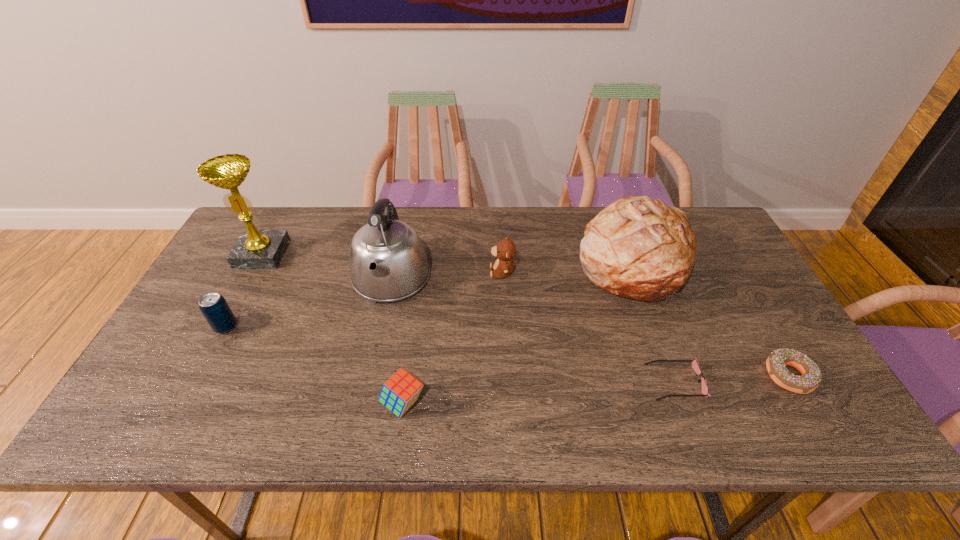
Locate an element on the screen. Image resolution: width=960 pixels, height=540 pixels. the tallest object is located at coordinates (255, 249).

This screenshot has width=960, height=540. Identify the location of kettle. (387, 260).

Where is `the third tallest object`? the third tallest object is located at coordinates (639, 248).

At what (x,y) coordinates should I click in order to perform the action: click on the fifth object from left to right. Please return your answer as a coordinate pair (x, y). The width and height of the screenshot is (960, 540). Looking at the image, I should click on (505, 250).

The height and width of the screenshot is (540, 960). I want to click on the fifth farthest object, so click(x=213, y=306).

Find the location of `cube`. cube is located at coordinates (401, 391).

You are a GUI agent. You are given a task and a screenshot of the screen. Output one action in this format:
    pyautogui.click(x=<x>, y=<y>)
    Task: Click on the rightmost object
    
    Given the screenshot: What is the action you would take?
    pyautogui.click(x=776, y=363)

Locate an element on the screen. Image resolution: width=960 pixels, height=540 pixels. doughnut is located at coordinates (776, 363).

The image size is (960, 540). What are the coordinates of `sunglasses` in the screenshot? It's located at (695, 365).

Where is `free point located 0.360m on the front-facing side of the tallest object`? free point located 0.360m on the front-facing side of the tallest object is located at coordinates (200, 372).